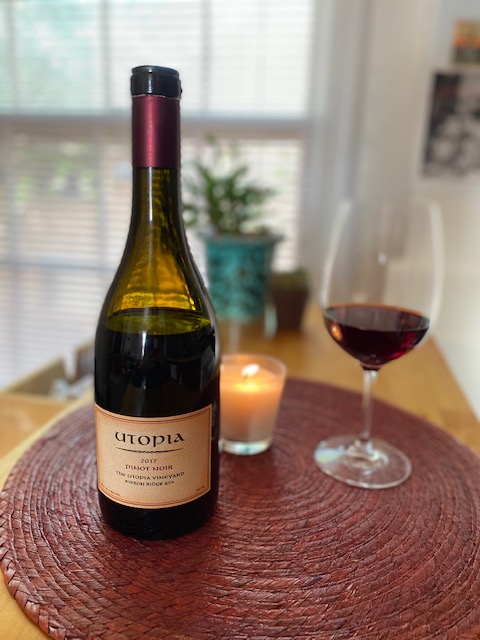
The image size is (480, 640). In order to click on candle in this screenshot , I will do `click(255, 416)`.